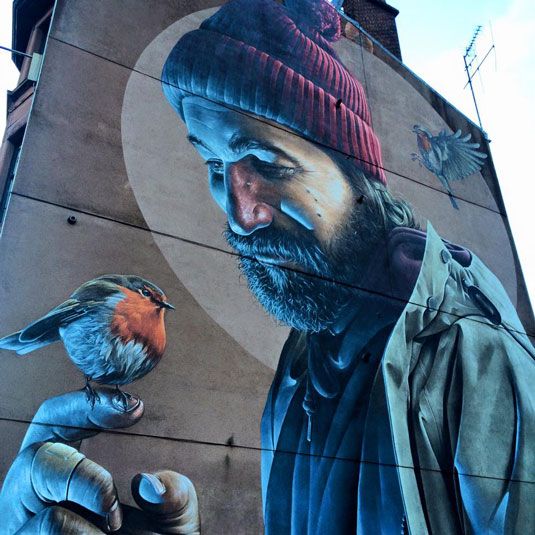
Where is `wall`? The width and height of the screenshot is (535, 535). wall is located at coordinates (253, 412).